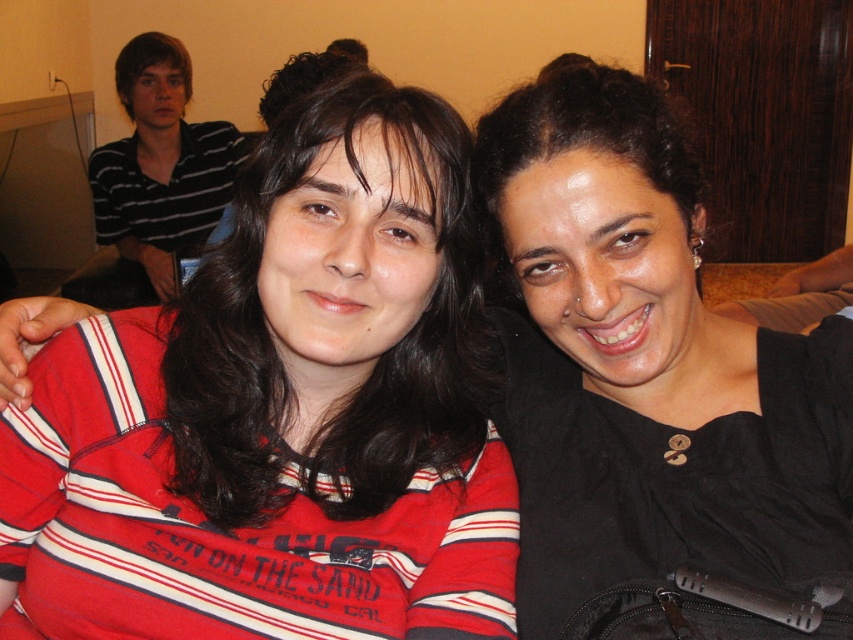
Question: Does red striped shirt at left lie behind black matte hair at upper right?

Choices:
 (A) no
 (B) yes

Answer: (B)

Question: Which object is the farthest from the striped cotton shirt at upper left?

Choices:
 (A) black matte hair at upper right
 (B) red striped shirt at left

Answer: (A)

Question: Does red striped shirt at left have a larger size compared to striped cotton shirt at upper left?

Choices:
 (A) yes
 (B) no

Answer: (B)

Question: Estimate the real-world distances between objects in this image. Which object is closer to the striped cotton shirt at upper left?

Choices:
 (A) red striped shirt at left
 (B) black matte hair at upper right

Answer: (A)

Question: Does red striped shirt at left have a smaller size compared to striped cotton shirt at upper left?

Choices:
 (A) no
 (B) yes

Answer: (B)

Question: Which point is farther from the camera taking this photo?

Choices:
 (A) (804, 387)
 (B) (357, 160)
 (C) (114, 74)

Answer: (C)